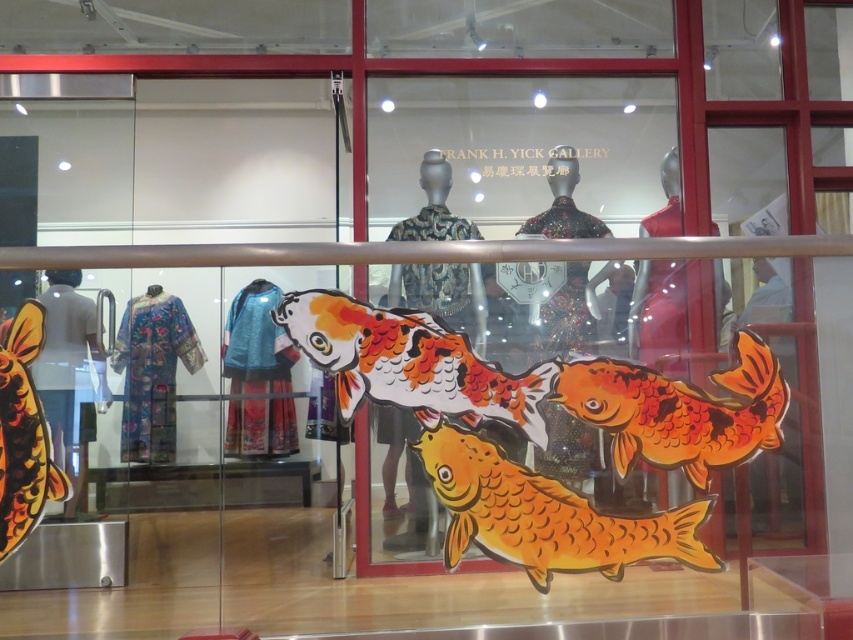
Question: Among these points, which one is farthest from the camera?

Choices:
 (A) (463, 545)
 (B) (578, 412)
 (C) (453, 376)
 (D) (6, 556)

Answer: (B)

Question: Which point is farther to the camera?

Choices:
 (A) orange and white painted fish at center
 (B) orange matte fish at center

Answer: (A)

Question: Can you confirm if orange glossy koi at center is wider than shiny orange fish at lower left?

Choices:
 (A) no
 (B) yes

Answer: (B)

Question: Does orange matte fish at center have a smaller size compared to orange and white painted fish at center?

Choices:
 (A) yes
 (B) no

Answer: (B)

Question: Which object appears farthest from the camera in this image?

Choices:
 (A) orange and white painted fish at center
 (B) orange glossy koi at center
 (C) shiny orange fish at lower left
 (D) orange matte fish at center

Answer: (B)

Question: Does orange glossy koi at center have a larger size compared to shiny orange fish at lower left?

Choices:
 (A) yes
 (B) no

Answer: (A)